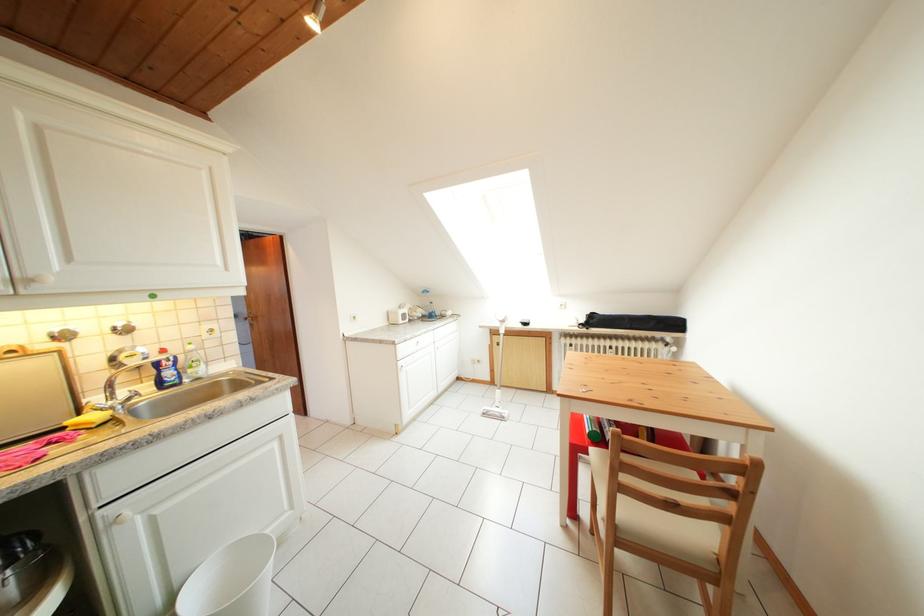
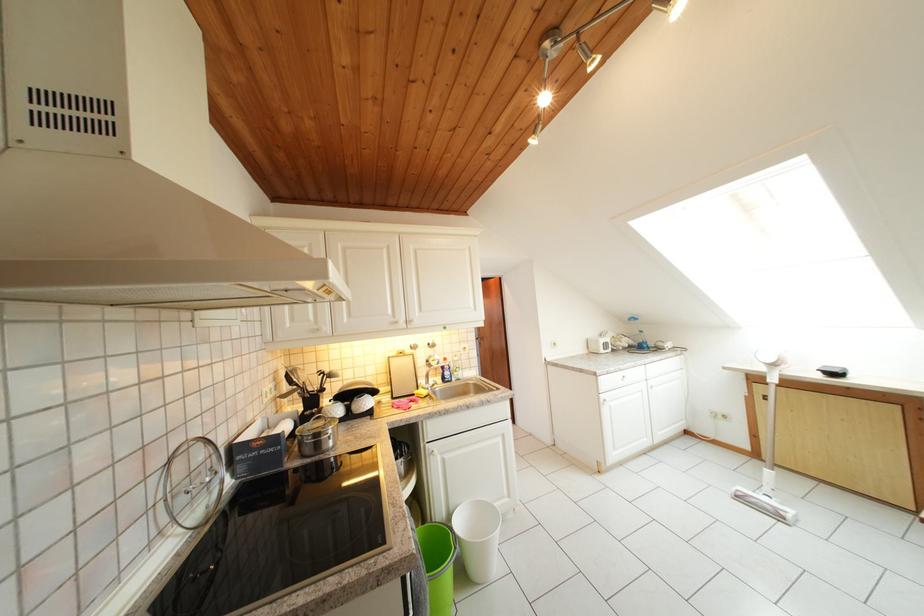
Locate, in the second image, the point that corresponds to the point at 501,387 in the first image.

(764, 460)